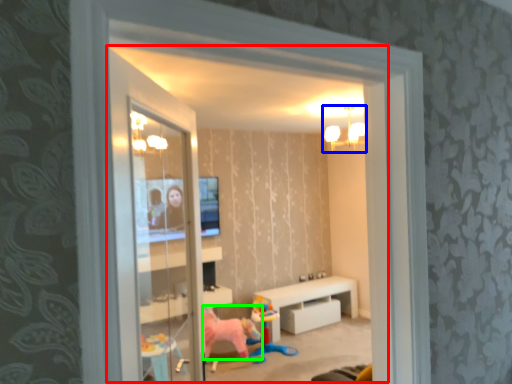
Question: Estimate the real-world distances between objects in this image. Which object is farther from window (highlighted by a red box), light fixture (highlighted by a blue box) or animal (highlighted by a green box)?

Choices:
 (A) light fixture
 (B) animal

Answer: (B)